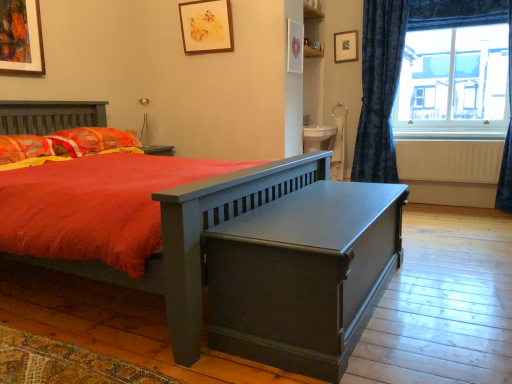
Question: Would you say matte wooden picture frame at upper center, which ranks as the 4th picture frame in front-to-back order, is to the left or to the right of fluffy orange pillow at left, which ranks as the first pillow in front-to-back order, in the picture?

Choices:
 (A) left
 (B) right

Answer: (B)

Question: From a real-world perspective, is matte wooden picture frame at upper center, positioned as the fourth picture frame in left-to-right order, physically located above or below fluffy orange pillow at left, which appears as the 2th pillow when viewed from the back?

Choices:
 (A) above
 (B) below

Answer: (A)

Question: Estimate the real-world distances between objects in this image. Which object is farther from the matte white picture frame at upper center, which is counted as the third picture frame, starting from the left?

Choices:
 (A) matte wooden picture frame at upper left, the 4th picture frame when ordered from right to left
 (B) matte wooden picture frame at upper center, positioned as the fourth picture frame in left-to-right order
 (C) transparent glass window at upper right
 (D) matte dark green trunk at center
 (E) fluffy orange pillow at left, which ranks as the first pillow in front-to-back order

Answer: (D)

Question: Based on their relative distances, which object is nearer to the wooden picture frame at upper center, placed as the third picture frame when sorted from front to back?

Choices:
 (A) blue textured curtain at right, which is the 2th curtain from right to left
 (B) matte dark green trunk at center
 (C) fluffy orange pillow at left, which appears as the 2th pillow when viewed from the back
 (D) transparent glass window at upper right
 (E) matte wooden picture frame at upper center, the 1th picture frame viewed from the back

Answer: (E)